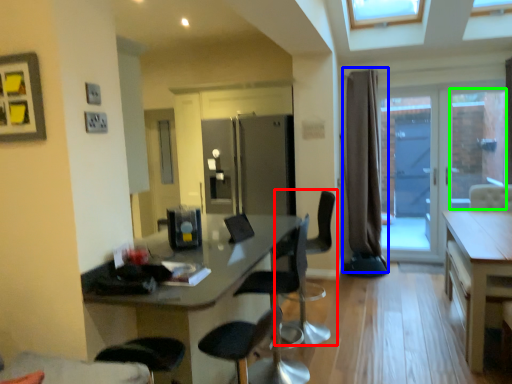
Question: Considering the real-world distances, which object is closest to chair (highlighted by a red box)? curtain (highlighted by a blue box) or window (highlighted by a green box).

Choices:
 (A) curtain
 (B) window

Answer: (A)